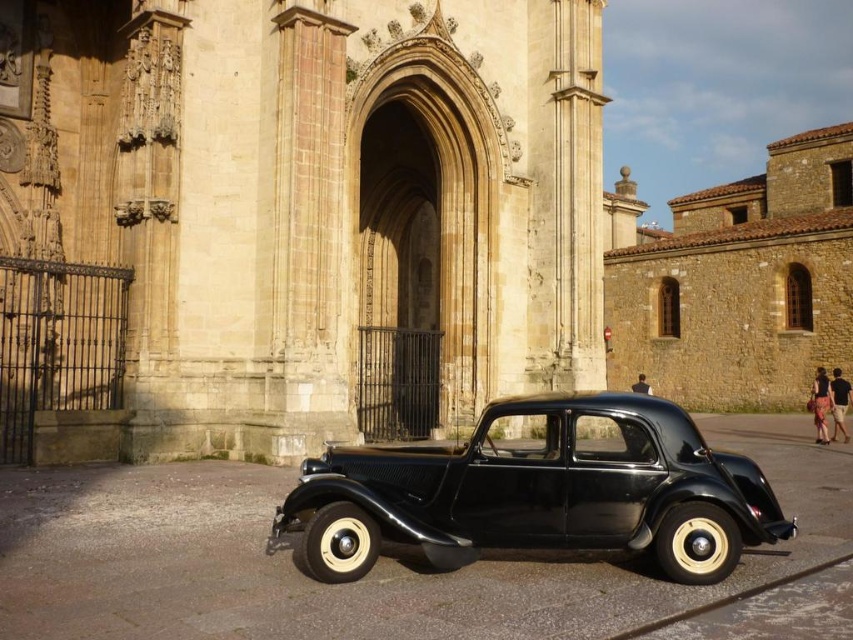
Based on the photo, is beige stone church at center below brown stone church at right?

Yes, beige stone church at center is below brown stone church at right.

Does beige stone church at center appear on the right side of brown stone church at right?

No, beige stone church at center is not to the right of brown stone church at right.

Between point (294, 300) and point (808, 289), which one is positioned in front?

Positioned in front is point (294, 300).

This screenshot has height=640, width=853. Find the location of `beige stone church at center`. beige stone church at center is located at coordinates (306, 202).

Who is positioned more to the right, shiny black car at center or brown stone church at right?

brown stone church at right

Does shiny black car at center appear under brown stone church at right?

Correct, shiny black car at center is located below brown stone church at right.

The height and width of the screenshot is (640, 853). I want to click on shiny black car at center, so click(x=538, y=492).

Consider the image. Does beige stone church at center have a lesser height compared to shiny black car at center?

In fact, beige stone church at center may be taller than shiny black car at center.

The image size is (853, 640). I want to click on beige stone church at center, so click(306, 202).

Identify the location of beige stone church at center. (306, 202).